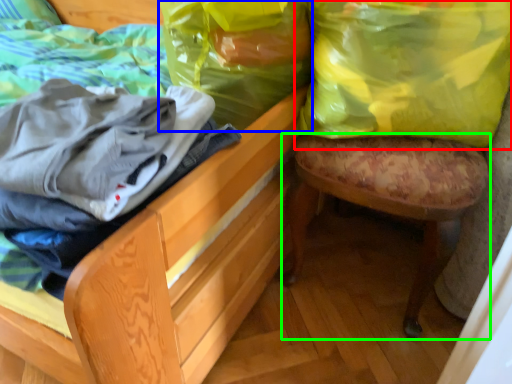
Question: Which is nearer to the shopping bag (highlighted by a red box)? shopping bag (highlighted by a blue box) or stool (highlighted by a green box).

Choices:
 (A) shopping bag
 (B) stool

Answer: (B)